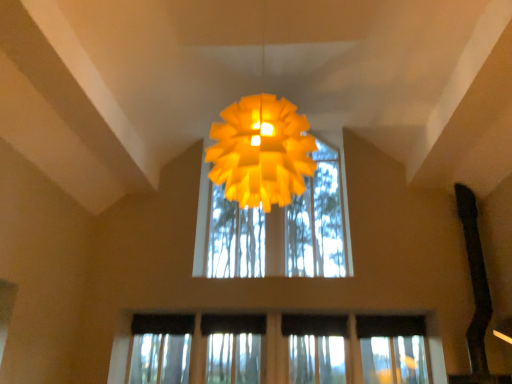
Question: Considering the relative sizes of matte yellow paper lamp at center and transparent glass window at center in the image provided, is matte yellow paper lamp at center taller than transparent glass window at center?

Choices:
 (A) yes
 (B) no

Answer: (A)

Question: Is matte yellow paper lamp at center thinner than transparent glass window at center?

Choices:
 (A) no
 (B) yes

Answer: (A)

Question: Are matte yellow paper lamp at center and transparent glass window at center located far from each other?

Choices:
 (A) yes
 (B) no

Answer: (A)

Question: Is matte yellow paper lamp at center oriented away from transparent glass window at center?

Choices:
 (A) yes
 (B) no

Answer: (A)

Question: Can you confirm if matte yellow paper lamp at center is smaller than transparent glass window at center?

Choices:
 (A) no
 (B) yes

Answer: (A)

Question: Can we say matte yellow paper lamp at center lies outside transparent glass window at center?

Choices:
 (A) yes
 (B) no

Answer: (A)

Question: Can you confirm if transparent glass window at center is bigger than matte yellow paper lamp at center?

Choices:
 (A) no
 (B) yes

Answer: (A)

Question: Can you confirm if transparent glass window at center is taller than matte yellow paper lamp at center?

Choices:
 (A) yes
 (B) no

Answer: (B)

Question: From a real-world perspective, does transparent glass window at center stand above matte yellow paper lamp at center?

Choices:
 (A) no
 (B) yes

Answer: (A)

Question: Is transparent glass window at center facing away from matte yellow paper lamp at center?

Choices:
 (A) no
 (B) yes

Answer: (A)

Question: Would you say transparent glass window at center is a long distance from matte yellow paper lamp at center?

Choices:
 (A) no
 (B) yes

Answer: (B)

Question: Does transparent glass window at center have a lesser height compared to matte yellow paper lamp at center?

Choices:
 (A) yes
 (B) no

Answer: (A)

Question: From the image's perspective, relative to transparent glass window at center, is matte yellow paper lamp at center above or below?

Choices:
 (A) below
 (B) above

Answer: (B)